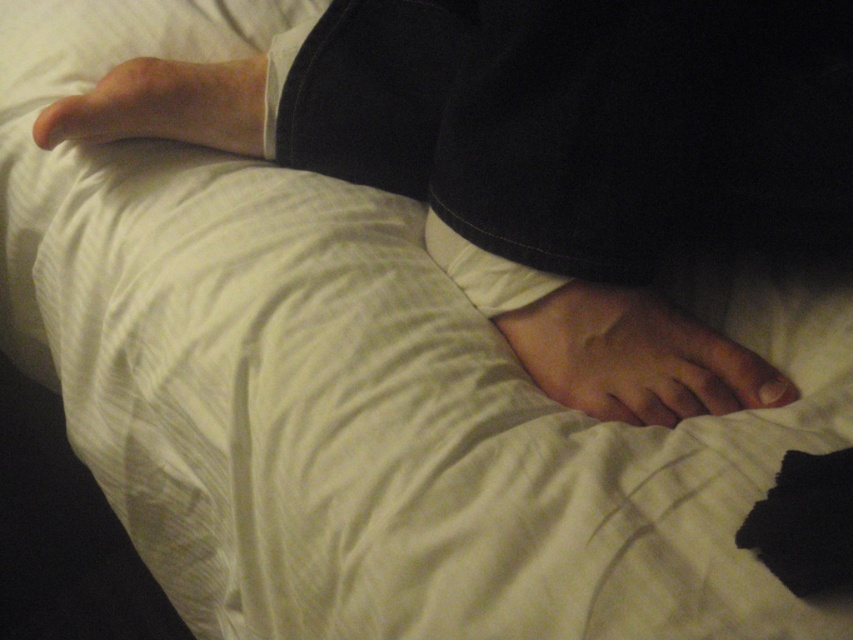
You are a healthcare professional assessing the positioning of a patient in bed. The patient has a point marked at coordinates point (595, 396). You need to place a sensor 20 inches away from this point to monitor their movement. Based on the scene, is the bed large enough to accommodate this placement?

The distance between point (595, 396) and the viewer is 19.71 inches, which is slightly less than the required 20 inches. Therefore, the bed may not have enough space to place the sensor 20 inches away from the marked point.